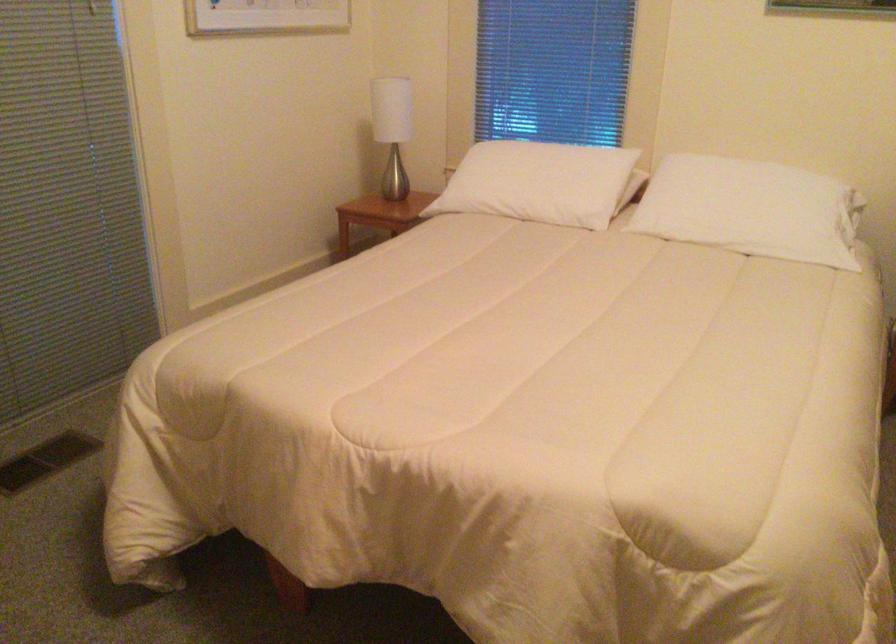
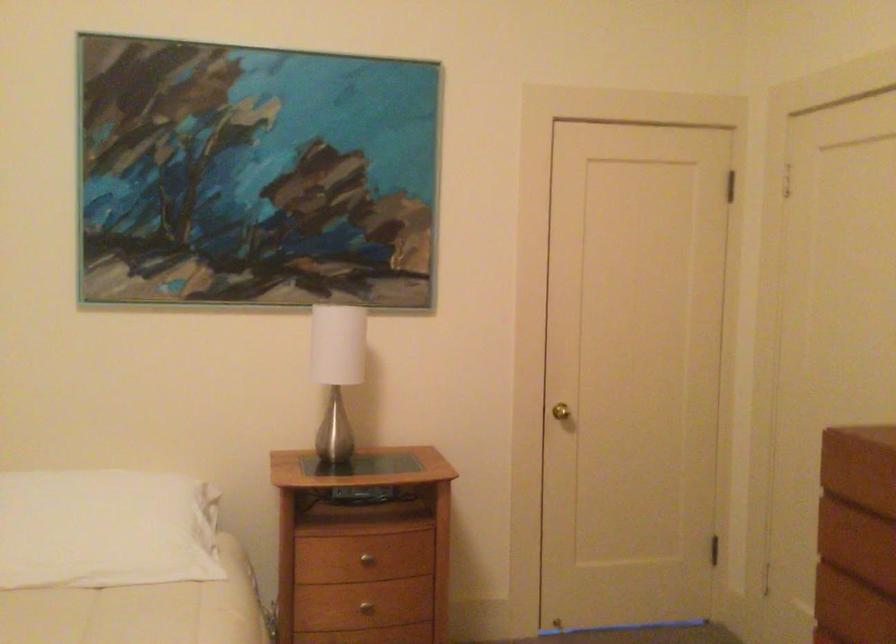
Question: The camera is either moving clockwise (left) or counter-clockwise (right) around the object. The first image is from the beginning of the video and the second image is from the end. Is the camera moving left or right when shooting the video?

Choices:
 (A) Left
 (B) Right

Answer: (A)